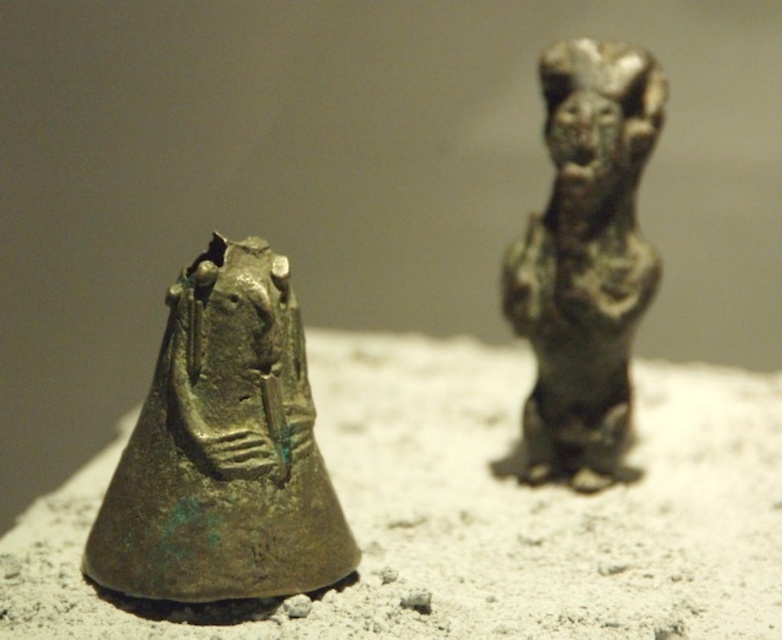
Can you confirm if green patina bronze statue at left is positioned to the right of bronze figurine at right?

Incorrect, green patina bronze statue at left is not on the right side of bronze figurine at right.

Between point (307, 400) and point (637, 305), which one is positioned in front?

Point (307, 400)

Describe the element at coordinates (223, 449) in the screenshot. The height and width of the screenshot is (640, 782). I see `green patina bronze statue at left` at that location.

Find the location of a particular element. This screenshot has height=640, width=782. green patina bronze statue at left is located at coordinates (223, 449).